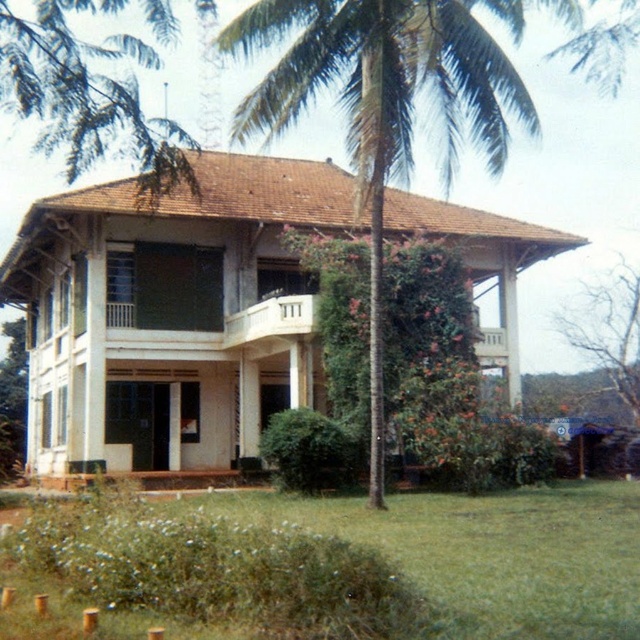
You are standing in front of the colonial building and want to know about the greenery around it. Which of the two objects, the green grass at lower center or the green leafy tree at upper left, is larger in size?

The green leafy tree at upper left is larger than the green grass at lower center.

You are standing in front of the two story colonial style building with a red tiled roof. There is a point marked at coordinates (385, 102). What object is located at that point?

The point at coordinates (385, 102) corresponds to the green leafy palm tree at center.